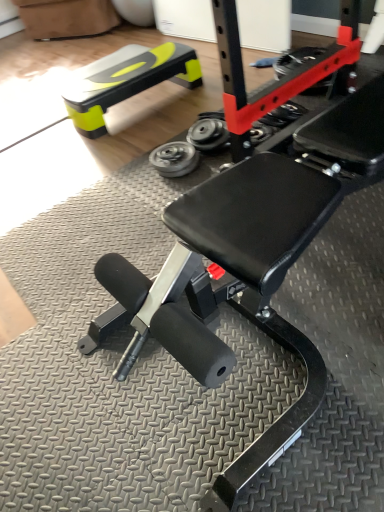
This screenshot has height=512, width=384. I want to click on vacant space in front of neon yellow plastic bench at upper left, so click(x=129, y=145).